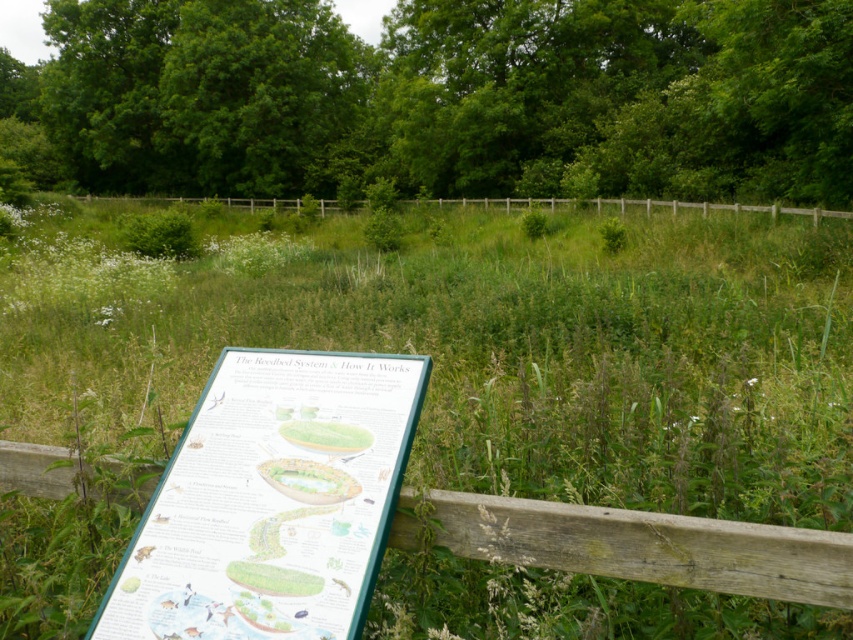
You are standing in the nature reserve and see two points marked on the informational sign. The first point is labeled as point (697,113) and the second as point (270,372). Which point is closer to your eyes?

Point (697,113) is further to the camera than point (270,372), so the point closer to your eyes is point (270,372).

From the picture: You are standing at the center of the image and want to locate the green plastic sign at center. According to the coordinates provided, in which direction should you look to find it?

The green plastic sign at center is located at coordinates 0.783 on the x axis and 0.319 on the y axis. Since you are at the center, which is typically at coordinates (426,320), you should look towards the upper right direction to find the green plastic sign at center.

You are a park visitor who wants to read the informational sign about the reedbed system. You see the green plastic sign at center and the wooden at center. Which one is larger and more likely to have the detailed diagram mentioned in the scene description?

The green plastic sign at center is bigger than wooden at center, so it is more likely to have the detailed diagram mentioned in the scene description.